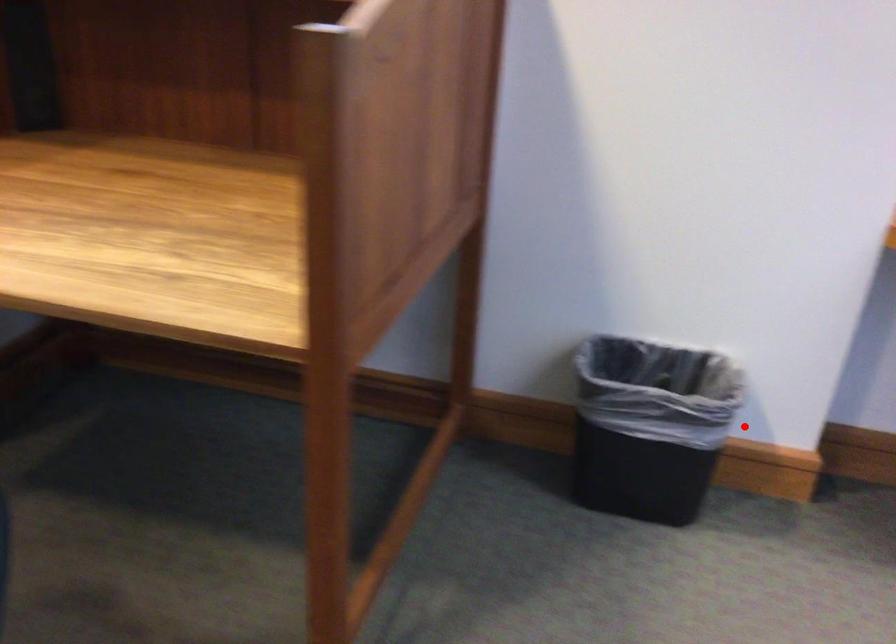
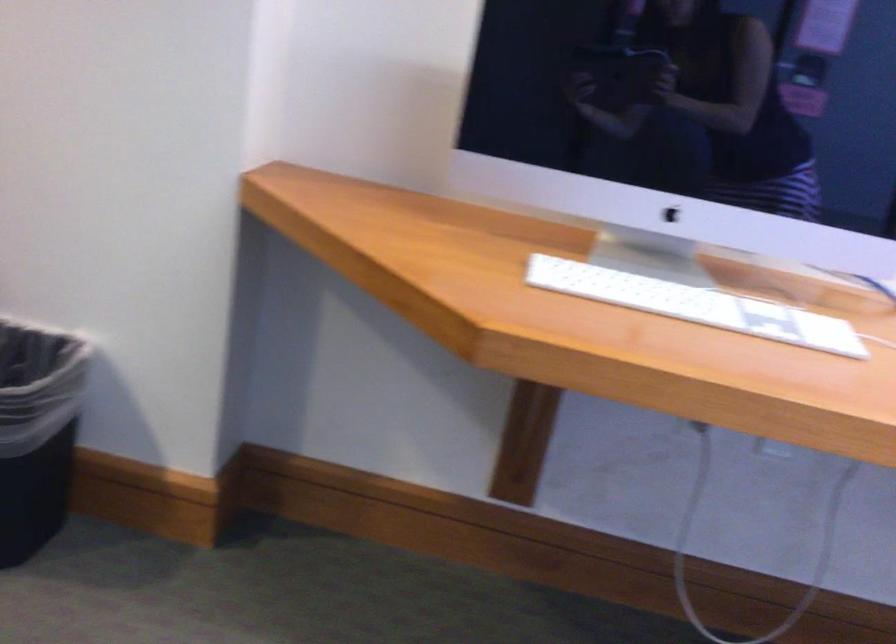
The point at the highlighted location is marked in the first image. Where is the corresponding point in the second image?

(37, 431)